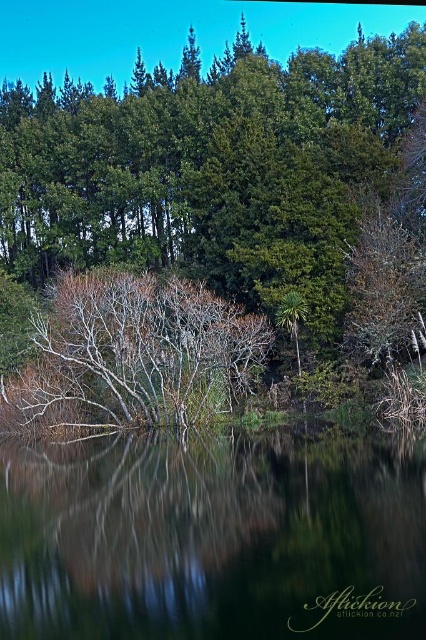
Can you confirm if green leafy tree at center is bigger than bare branches at center?

Correct, green leafy tree at center is larger in size than bare branches at center.

Which is behind, point (268, 113) or point (78, 412)?

Point (268, 113)

The image size is (426, 640). Find the location of `green leafy tree at center`. green leafy tree at center is located at coordinates (210, 168).

Looking at this image, between green leafy tree at center and transparent water at center, which one is positioned higher?

green leafy tree at center is above.

Which is more to the right, green leafy tree at center or transparent water at center?

Positioned to the right is green leafy tree at center.

Does point (236, 35) lie behind point (160, 628)?

Yes, point (236, 35) is behind point (160, 628).

Where is `green leafy tree at center`? green leafy tree at center is located at coordinates (210, 168).

The width and height of the screenshot is (426, 640). What do you see at coordinates (213, 538) in the screenshot?
I see `transparent water at center` at bounding box center [213, 538].

In the scene shown: Between transparent water at center and bare branches at center, which one has less height?

transparent water at center

What are the coordinates of `transparent water at center` in the screenshot? It's located at (213, 538).

What are the coordinates of `transparent water at center` in the screenshot? It's located at (213, 538).